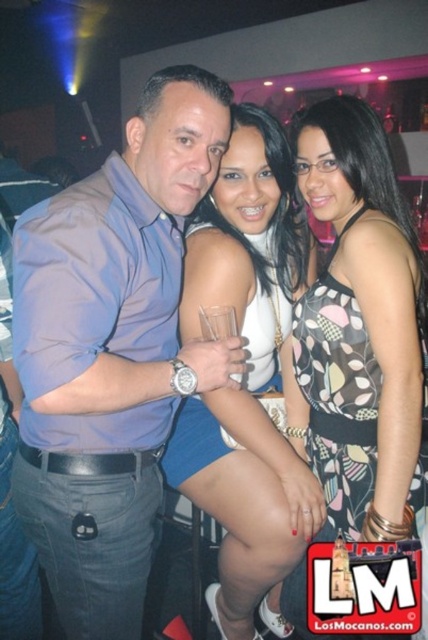
You are a photographer at the event and want to ensure both the matte blue shirt at center and the matte white tank top at center are clearly visible in the photo. Which clothing item should you focus on first to ensure the entire height of both is captured?

The matte blue shirt at center has a lesser height compared to the matte white tank top at center, so you should focus on ensuring the matte white tank top at center is fully in frame first since it is taller and requires more vertical space.

Looking at this image, you are a photographer trying to frame two people in the center of the image for a closeup shot. The subjects are wearing a printed fabric dress at center and a matte white tank top at center. Based on their clothing widths, which one should you focus on to ensure they fit comfortably in the frame?

The printed fabric dress at center has a lesser width compared to the matte white tank top at center, so focusing on the matte white tank top at center would allow for a more comfortable fit in the frame since it occupies more space.

You are a photographer at a party and notice two people wearing the printed fabric dress at center and the matte white tank top at center. Which clothing item is smaller in size?

The printed fabric dress at center is smaller than the matte white tank top at center.